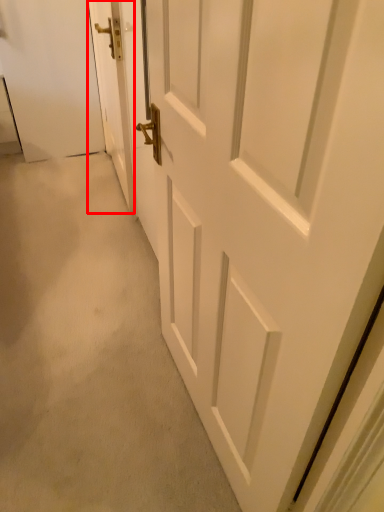
Question: Considering the relative positions of door (annotated by the red box) and door in the image provided, where is door (annotated by the red box) located with respect to the staircase?

Choices:
 (A) right
 (B) left

Answer: (B)